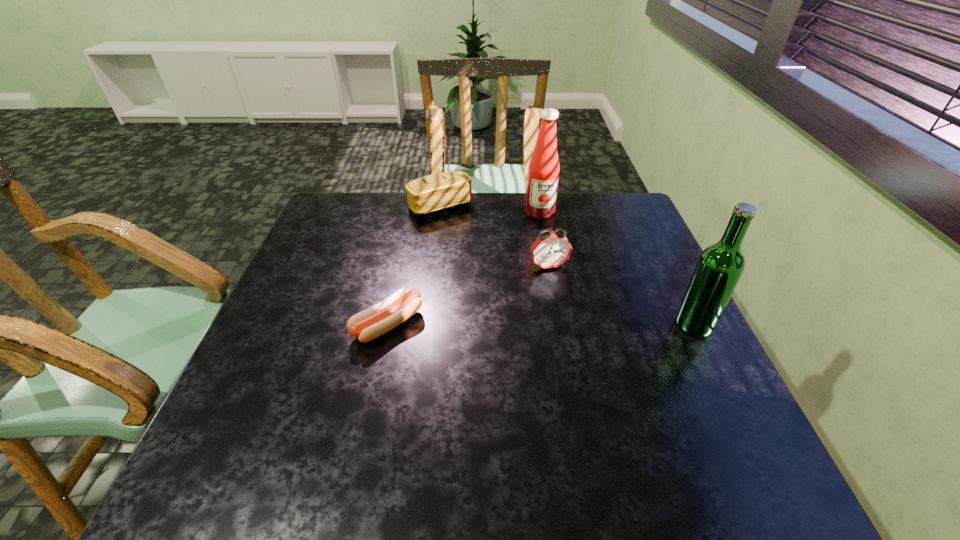
Identify the location of blank space at the far edge of the desktop. (486, 198).

In the image, there is a desktop. Where is `vacant space at the near edge`? vacant space at the near edge is located at coordinates (617, 414).

The width and height of the screenshot is (960, 540). In the image, there is a desktop. Find the location of `vacant space at the left edge`. vacant space at the left edge is located at coordinates (250, 370).

Find the location of `vacant space at the right edge of the desktop`. vacant space at the right edge of the desktop is located at coordinates (639, 355).

You are a GUI agent. You are given a task and a screenshot of the screen. Output one action in this format:
    pyautogui.click(x=<x>, y=<y>)
    Task: Click on the free space at the far left corner of the desktop
    The width and height of the screenshot is (960, 540).
    Given the screenshot: What is the action you would take?
    pyautogui.click(x=355, y=215)

Where is `blank space at the near left corner`? The height and width of the screenshot is (540, 960). blank space at the near left corner is located at coordinates (222, 427).

You are a GUI agent. You are given a task and a screenshot of the screen. Output one action in this format:
    pyautogui.click(x=<x>, y=<y>)
    Task: Click on the unoccupied position between the shortest object and the condiment
    The height and width of the screenshot is (540, 960).
    Given the screenshot: What is the action you would take?
    pyautogui.click(x=464, y=268)

Identify the location of free space between the third shortest object and the rightmost object. (621, 295).

This screenshot has width=960, height=540. I want to click on free space between the alarm clock and the rightmost object, so click(x=621, y=295).

Where is `vacant space that's between the beer bottle and the shortest object`? The width and height of the screenshot is (960, 540). vacant space that's between the beer bottle and the shortest object is located at coordinates (541, 324).